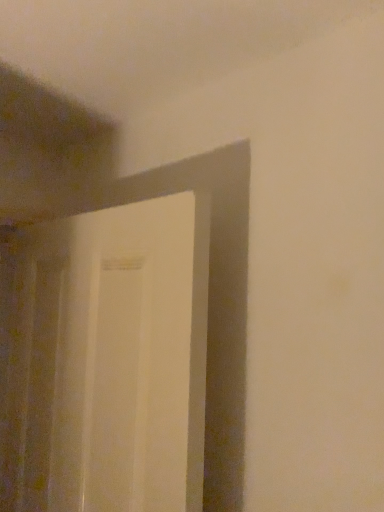
Find the location of `white glossy door at center`. white glossy door at center is located at coordinates (132, 360).

Describe the element at coordinates (132, 360) in the screenshot. I see `white glossy door at center` at that location.

Identify the location of white glossy door at center. Image resolution: width=384 pixels, height=512 pixels. (132, 360).